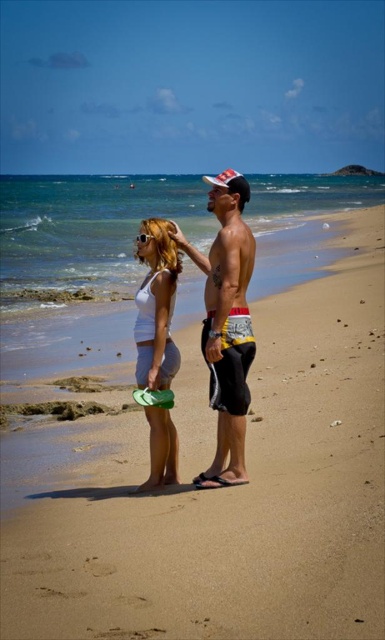
Is point (209, 568) positioned behind point (154, 291)?

No, (209, 568) is in front of (154, 291).

In order to click on sandy beach at center in this screenshot , I will do coord(236,496).

Is sandy beach at center positioned in front of shiny metallic shorts at center?

That is True.

Between sandy beach at center and shiny metallic shorts at center, which one appears on the left side from the viewer's perspective?

From the viewer's perspective, shiny metallic shorts at center appears more on the left side.

Who is more distant from viewer, (373, 225) or (249, 230)?

Positioned behind is point (373, 225).

What are the coordinates of `sandy beach at center` in the screenshot? It's located at (236, 496).

In the scene shown: Can you confirm if shiny metallic shorts at center is shorter than white matte tank top at center?

Yes, shiny metallic shorts at center is shorter than white matte tank top at center.

Does shiny metallic shorts at center have a greater height compared to white matte tank top at center?

Incorrect, shiny metallic shorts at center's height is not larger of white matte tank top at center's.

Does point (229, 196) come farther from viewer compared to point (162, 292)?

No.

In order to click on shiny metallic shorts at center in this screenshot , I will do `click(227, 328)`.